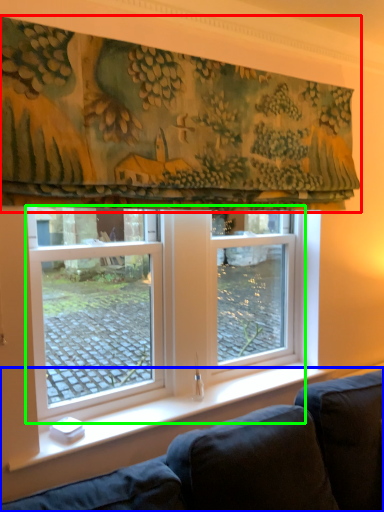
Question: Based on their relative distances, which object is nearer to curtain (highlighted by a red box)? Choose from studio couch (highlighted by a blue box) and window (highlighted by a green box).

Choices:
 (A) studio couch
 (B) window

Answer: (B)